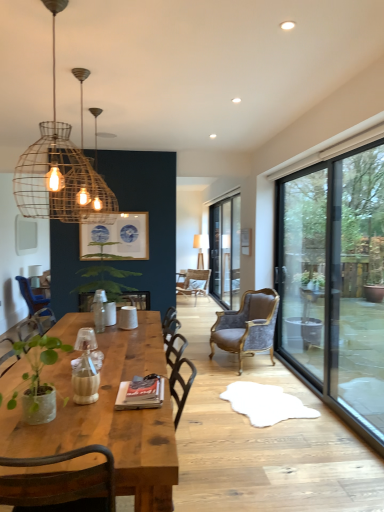
Where is `free space to the right of green matte plant at lower left, the first houseplant from the front`? free space to the right of green matte plant at lower left, the first houseplant from the front is located at coordinates (97, 424).